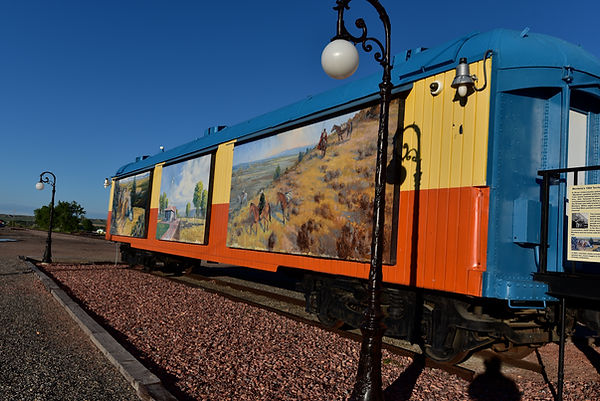
At what (x,y) coordinates should I click in order to perform the action: click on door. Please return your answer as a coordinate pair (x, y). Looking at the image, I should click on (576, 145).